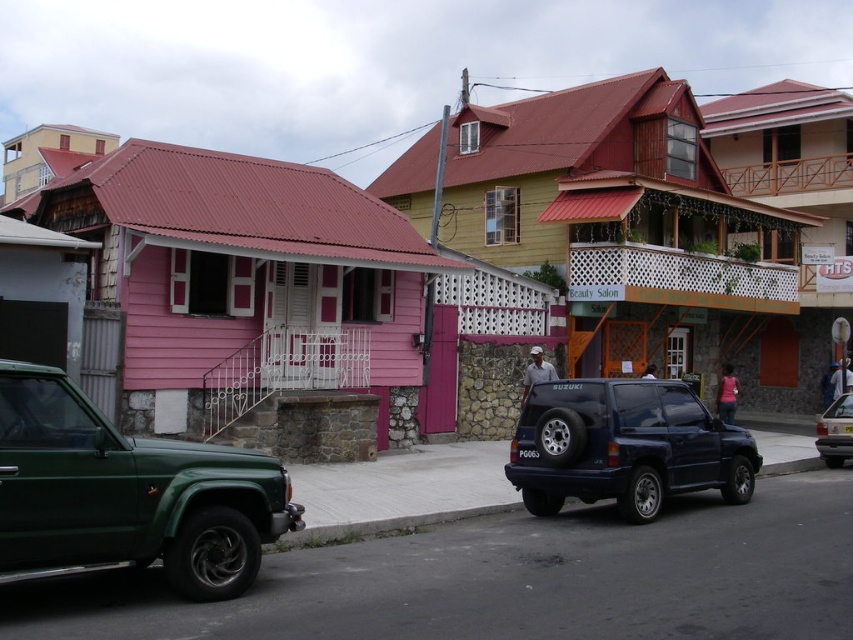
Is shiny dark blue suv at center closer to camera compared to metallic silver sedan at center?

That is True.

Which is behind, point (532, 444) or point (840, 412)?

The point (840, 412) is more distant.

Identify the location of shiny dark blue suv at center. (624, 445).

Identify the location of shiny dark blue suv at center. Image resolution: width=853 pixels, height=640 pixels. (624, 445).

Is the position of green matte pickup truck at lower left more distant than that of metallic silver sedan at center?

No, it is in front of metallic silver sedan at center.

Can you confirm if green matte pickup truck at lower left is taller than metallic silver sedan at center?

Indeed, green matte pickup truck at lower left has a greater height compared to metallic silver sedan at center.

Is point (215, 483) more distant than point (849, 401)?

No, it is in front of (849, 401).

At what (x,y) coordinates should I click in order to perform the action: click on green matte pickup truck at lower left. Please return your answer as a coordinate pair (x, y). The height and width of the screenshot is (640, 853). Looking at the image, I should click on (126, 493).

Measure the distance between point (128,536) and camera.

Point (128,536) is 6.09 meters away from camera.

Can you confirm if green matte pickup truck at lower left is positioned above shiny dark blue suv at center?

Yes.

Is point (22, 508) positioned after point (521, 476)?

That is False.

You are a GUI agent. You are given a task and a screenshot of the screen. Output one action in this format:
    pyautogui.click(x=<x>, y=<y>)
    Task: Click on the green matte pickup truck at lower left
    This screenshot has height=640, width=853.
    Given the screenshot: What is the action you would take?
    pyautogui.click(x=126, y=493)